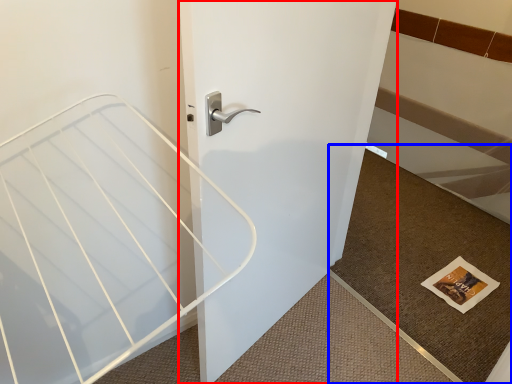
Question: Which object appears closest to the camera in this image, door (highlighted by a red box) or doormat (highlighted by a blue box)?

Choices:
 (A) door
 (B) doormat

Answer: (A)